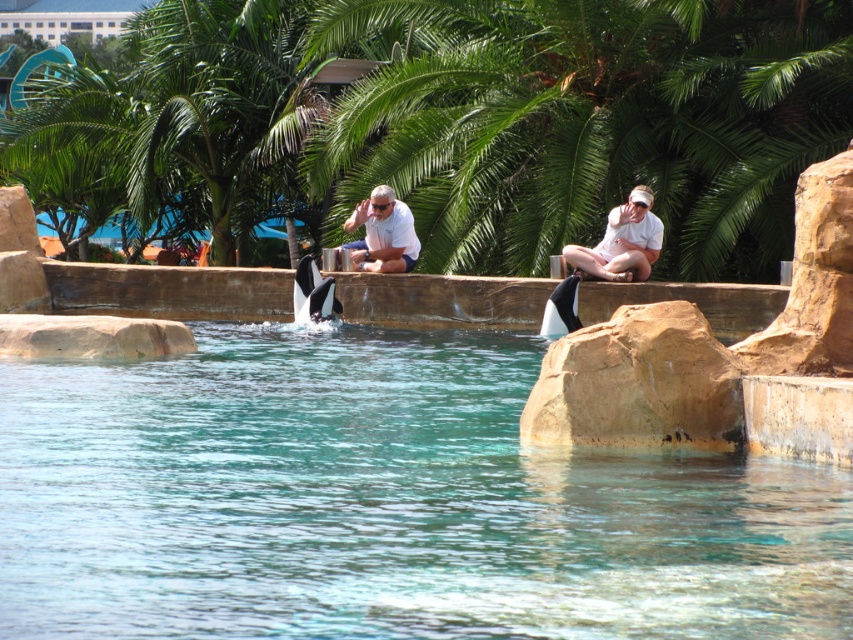
You are a photographer standing in the marine park and see the matte white skin at upper center and the white matte shirt at center. Which object is closer to the camera?

The matte white skin at upper center is positioned under the white matte shirt at center, so the white matte shirt at center is closer to the camera.

You are a visitor at the marine park and want to take a photo of the clear blue water at center and the white matte clothing at center. Which object should you focus on first to ensure both are in the frame?

You should focus on the clear blue water at center first because it is in front of the white matte clothing at center, so positioning the camera to include both requires starting with the closer object.